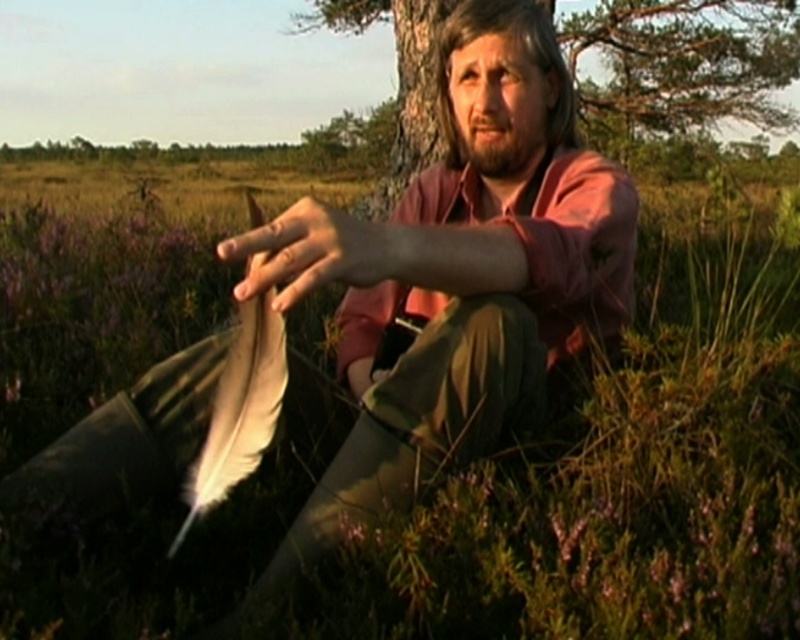
Question: Is the position of white feather at center less distant than that of brown fuzzy hair at upper center?

Choices:
 (A) yes
 (B) no

Answer: (A)

Question: Which object is positioned farthest from the brown fuzzy hair at upper center?

Choices:
 (A) brown rough tree at upper center
 (B) white feather at center
 (C) matte brown feather at center

Answer: (A)

Question: In this image, where is brown rough tree at upper center located relative to brown fuzzy hair at upper center?

Choices:
 (A) right
 (B) left

Answer: (A)

Question: Is brown rough tree at upper center below brown fuzzy hair at upper center?

Choices:
 (A) yes
 (B) no

Answer: (B)

Question: Estimate the real-world distances between objects in this image. Which object is closer to the white feather at center?

Choices:
 (A) brown fuzzy hair at upper center
 (B) brown rough tree at upper center
 (C) matte brown feather at center

Answer: (C)

Question: Which object appears farthest from the camera in this image?

Choices:
 (A) white feather at center
 (B) brown rough tree at upper center
 (C) matte brown feather at center

Answer: (B)